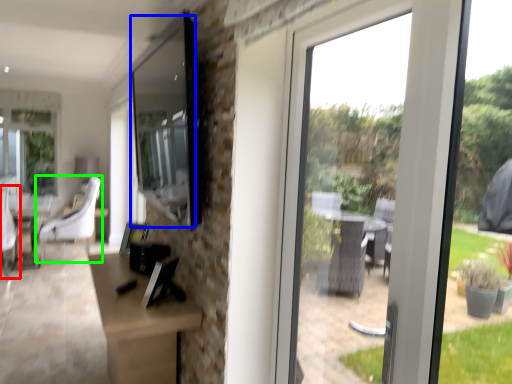
Question: Estimate the real-world distances between objects in this image. Which object is farther from swivel chair (highlighted by a red box), window screen (highlighted by a blue box) or chair (highlighted by a green box)?

Choices:
 (A) window screen
 (B) chair

Answer: (A)